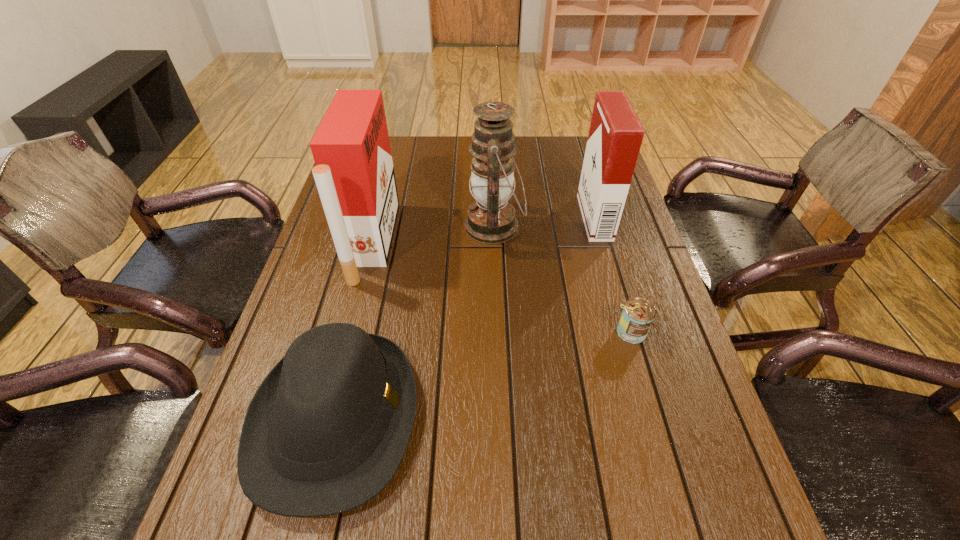
Image resolution: width=960 pixels, height=540 pixels. I want to click on unoccupied position between the right cigarette_case and the lantern, so click(544, 222).

I want to click on free point between the shortest object and the lantern, so click(563, 280).

Image resolution: width=960 pixels, height=540 pixels. Identify the location of free space between the can and the lantern. (563, 280).

Identify the location of object that stands as the fourth closest to the third object from left to right. (325, 432).

In order to click on object that is the closest to the left cigarette_case in this screenshot , I will do `click(325, 432)`.

This screenshot has height=540, width=960. I want to click on vacant point that satisfies the following two spatial constraints: 1. on the front-facing side of the shortest object; 2. on the right side of the left cigarette_case, so click(x=349, y=333).

At what (x,y) coordinates should I click in order to perform the action: click on free point that satisfies the following two spatial constraints: 1. on the front-facing side of the right cigarette_case; 2. on the right side of the shortest object. Please return your answer as a coordinate pair (x, y). Image resolution: width=960 pixels, height=540 pixels. Looking at the image, I should click on (628, 333).

The image size is (960, 540). Find the location of `free space in the image that satisfies the following two spatial constraints: 1. on the front side of the third object from right to left; 2. on the front-facing side of the second shortest object`. free space in the image that satisfies the following two spatial constraints: 1. on the front side of the third object from right to left; 2. on the front-facing side of the second shortest object is located at coordinates (501, 418).

Locate an element on the screen. The width and height of the screenshot is (960, 540). vacant position in the image that satisfies the following two spatial constraints: 1. on the front-facing side of the left cigarette_case; 2. on the back side of the can is located at coordinates (349, 333).

Where is `vacant region that satisfies the following two spatial constraints: 1. on the front-facing side of the can; 2. on the left side of the right cigarette_case`? The height and width of the screenshot is (540, 960). vacant region that satisfies the following two spatial constraints: 1. on the front-facing side of the can; 2. on the left side of the right cigarette_case is located at coordinates (628, 333).